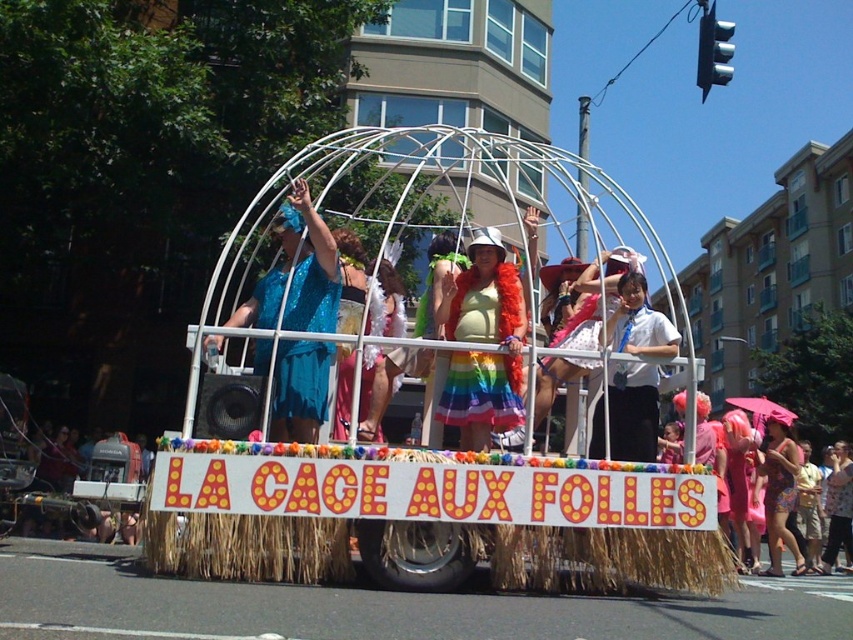
Can you confirm if blue sequined dress at center is positioned to the left of floral print dress at center?

Correct, you'll find blue sequined dress at center to the left of floral print dress at center.

Does blue sequined dress at center have a smaller size compared to floral print dress at center?

Yes.

Image resolution: width=853 pixels, height=640 pixels. Describe the element at coordinates (296, 273) in the screenshot. I see `blue sequined dress at center` at that location.

Locate an element on the screen. The height and width of the screenshot is (640, 853). blue sequined dress at center is located at coordinates (296, 273).

This screenshot has width=853, height=640. What do you see at coordinates (296, 273) in the screenshot? I see `blue sequined dress at center` at bounding box center [296, 273].

Who is more forward, (332, 282) or (770, 536)?

Point (332, 282) is in front.

Locate an element on the screen. Image resolution: width=853 pixels, height=640 pixels. blue sequined dress at center is located at coordinates click(x=296, y=273).

Between point (737, 472) and point (781, 512), which one is positioned in front?

Point (781, 512) is more forward.

Who is more distant from viewer, [727,426] or [788,547]?

The point [788,547] is behind.

Where is `pink satin dress at lower right`? This screenshot has height=640, width=853. pink satin dress at lower right is located at coordinates (750, 484).